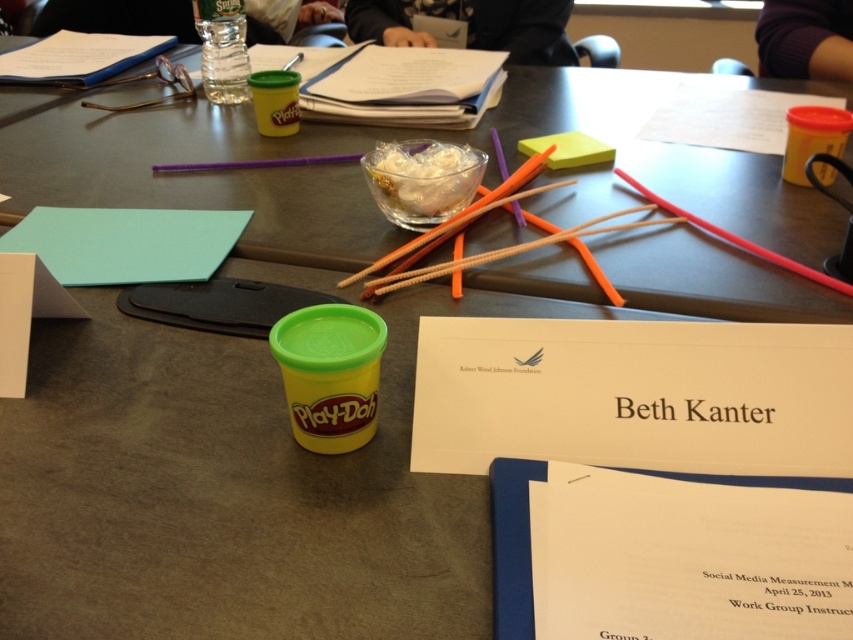
Is teal matte notepad at upper left below yellow sticky note at upper center?

Yes.

In the scene shown: Is teal matte notepad at upper left smaller than yellow sticky note at upper center?

Actually, teal matte notepad at upper left might be larger than yellow sticky note at upper center.

Does point (215, 220) lie in front of point (561, 132)?

That is True.

Locate an element on the screen. teal matte notepad at upper left is located at coordinates (126, 243).

Is green plastic play-doh at center smaller than yellow sticky note at upper center?

Indeed, green plastic play-doh at center has a smaller size compared to yellow sticky note at upper center.

Where is `green plastic play-doh at center`? green plastic play-doh at center is located at coordinates (329, 372).

Can you confirm if white cardstock at center is shorter than green plastic play-doh at center?

Indeed, white cardstock at center has a lesser height compared to green plastic play-doh at center.

Which is behind, point (746, 435) or point (321, 442)?

Positioned behind is point (321, 442).

Locate an element on the screen. The height and width of the screenshot is (640, 853). white cardstock at center is located at coordinates (633, 396).